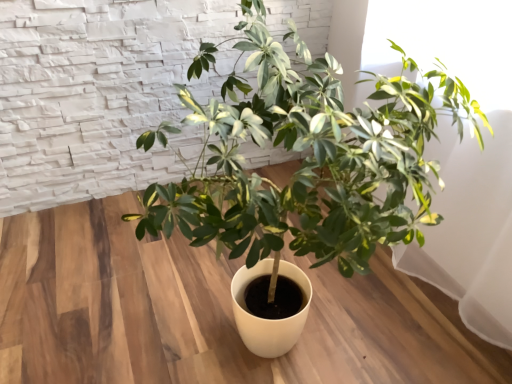
The width and height of the screenshot is (512, 384). Identify the location of green matte plant at center. (306, 158).

Describe the element at coordinates (306, 158) in the screenshot. I see `green matte plant at center` at that location.

What is the approximate width of green matte plant at center?

green matte plant at center is 34.89 inches in width.

You are a GUI agent. You are given a task and a screenshot of the screen. Output one action in this format:
    pyautogui.click(x=<x>, y=<y>)
    Task: Click on the green matte plant at center
    Image resolution: width=512 pixels, height=384 pixels.
    Given the screenshot: What is the action you would take?
    pyautogui.click(x=306, y=158)